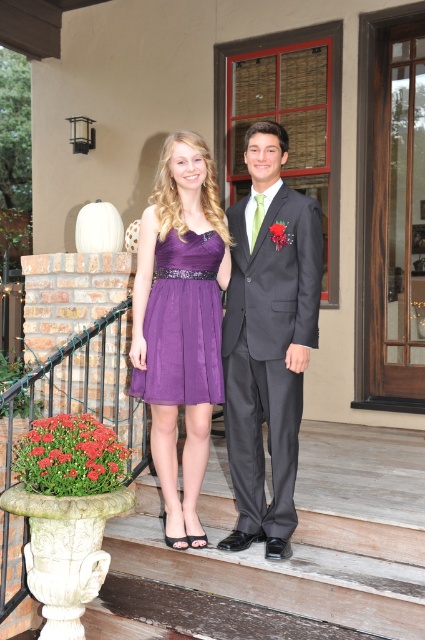
You are a photographer setting up for a formal portrait. You have a camera with a 1.5 meter wide backdrop. The backdrop is positioned between the charcoal gray suit at center and the purple satin dress at center. Will the backdrop be wide enough to cover both subjects comfortably?

The charcoal gray suit at center is wider than the purple satin dress at center. Since the backdrop is 1.5 meters wide and placed between them, it should be sufficient to cover both subjects as the total width required would be less than or equal to 1.5 meters.

You are attending a formal event and need to choose between the purple satin dress at center and the purple chiffon dress at center based on their sizes. Which one is bigger?

The purple satin dress at center is larger in size compared to the purple chiffon dress at center.